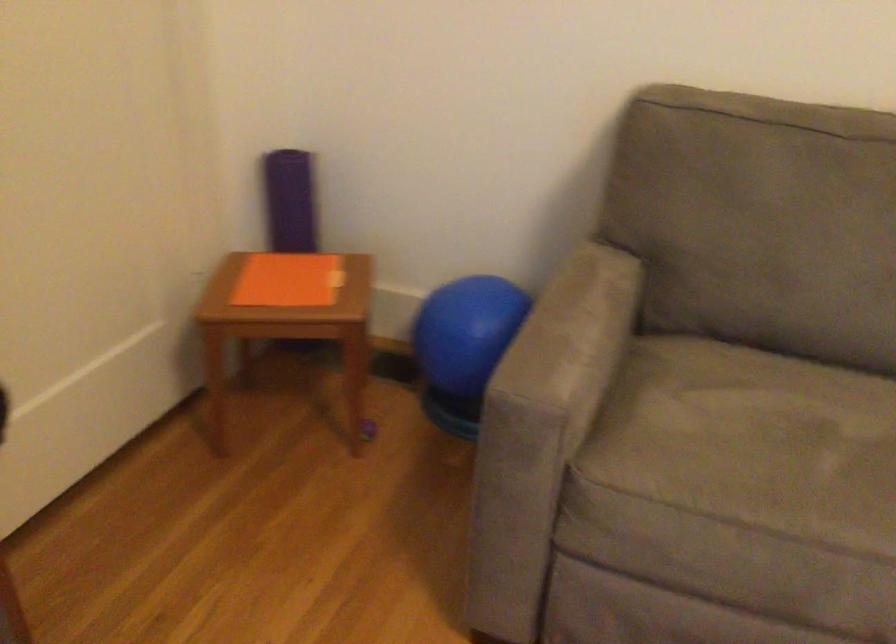
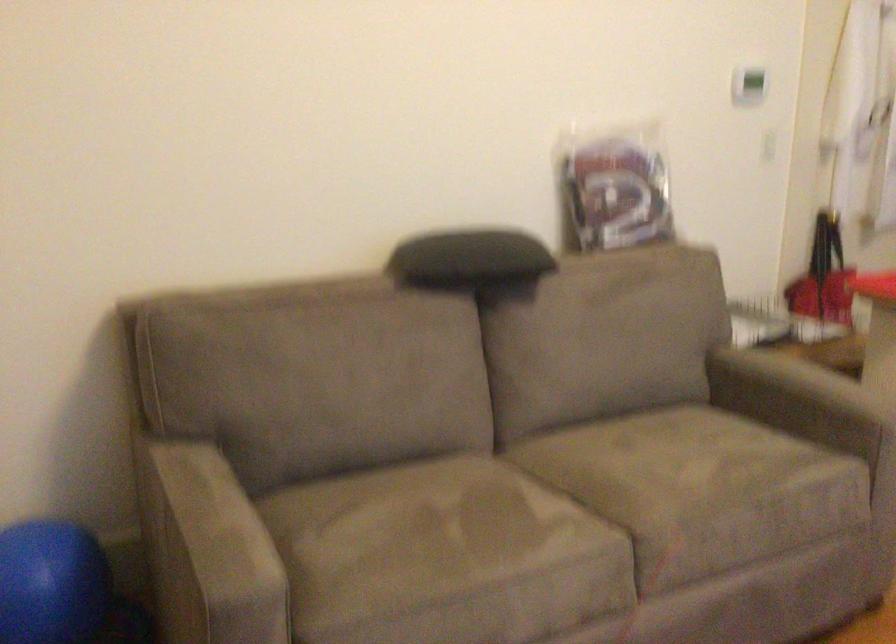
Question: Based on the continuous images, in which direction is the camera rotating? Reply with the corresponding letter.

Choices:
 (A) Left
 (B) Right
 (C) Up
 (D) Down

Answer: (B)